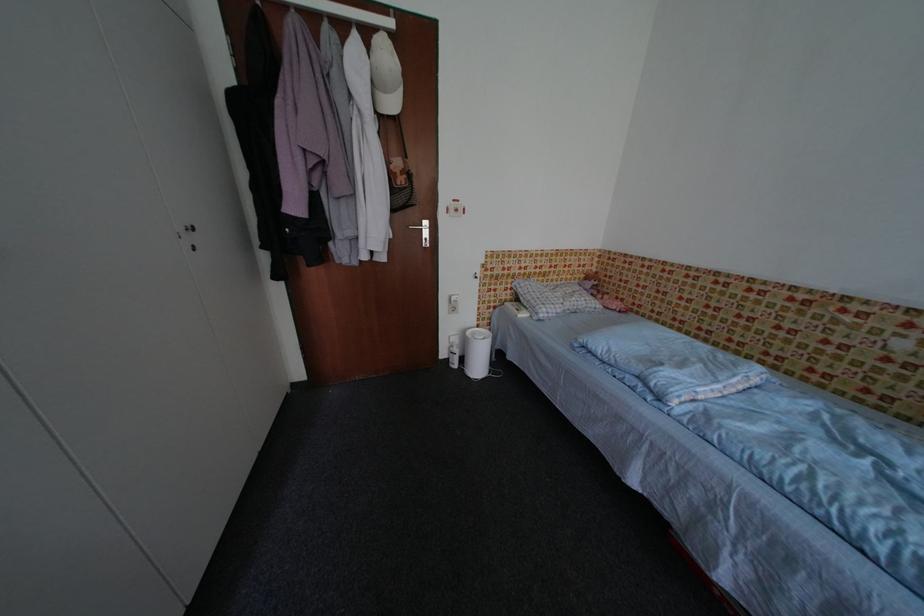
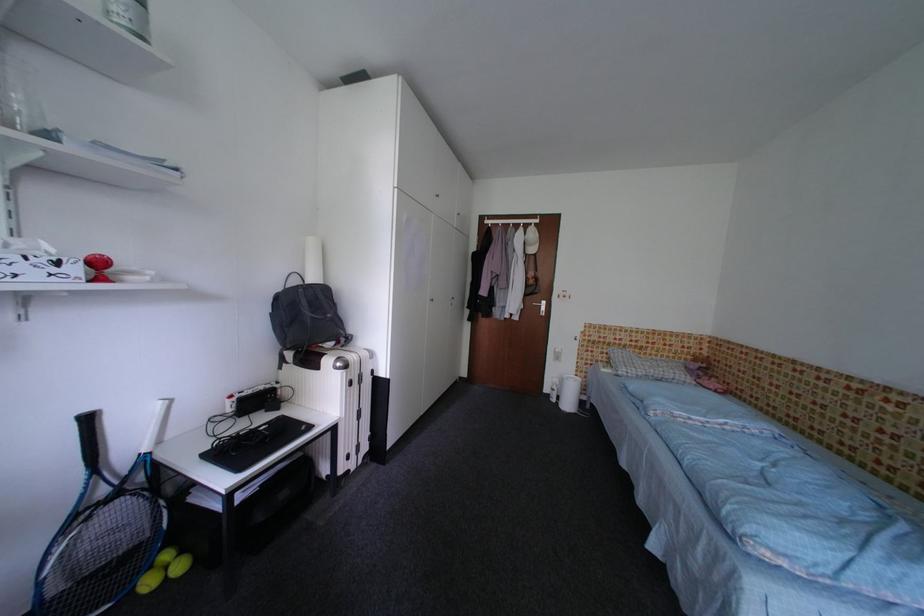
Find the pixel in the second image that matches the point at 574,282 in the first image.

(675, 360)